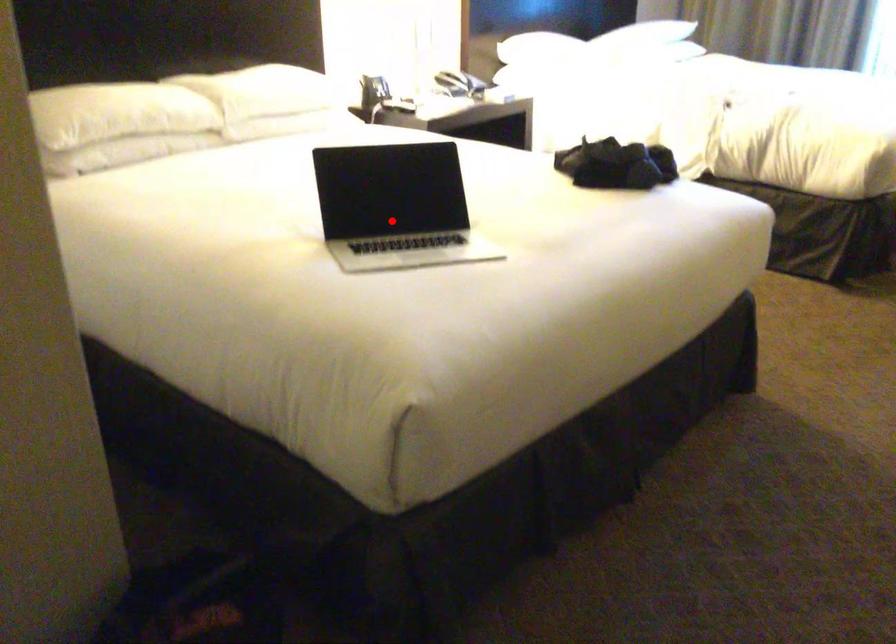
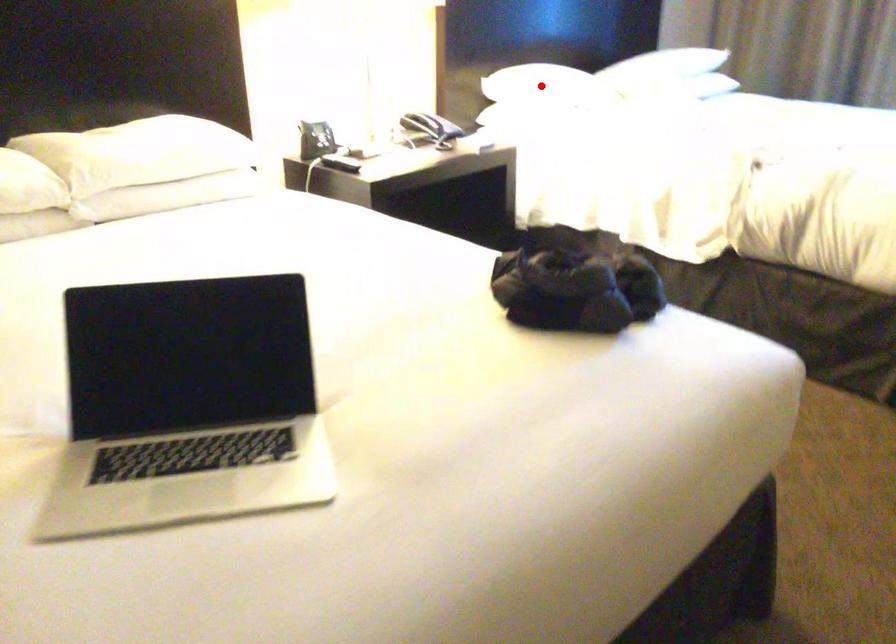
I am providing you with two images of the same scene from different viewpoints. A red point is marked on the first image and another point is marked on the second image. Do the highlighted points in image1 and image2 indicate the same real-world spot?

No